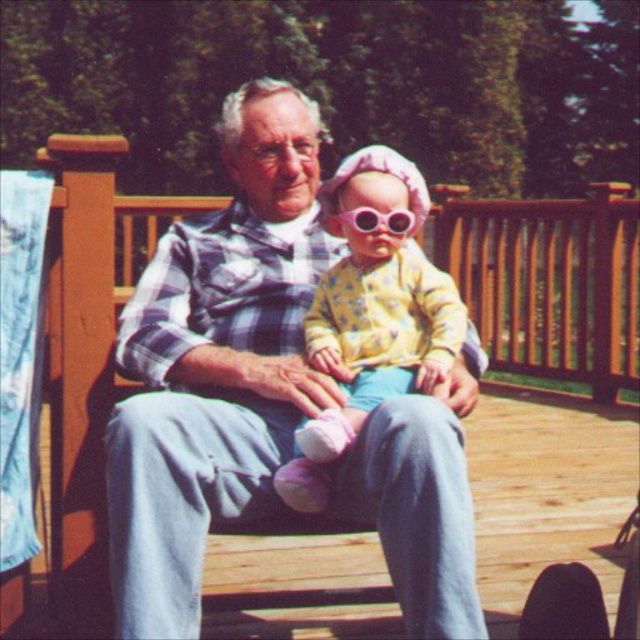
Is matte plaid shirt at center positioned before pink plastic goggles at center?

Yes.

Find the location of `matte plaid shirt at center`. matte plaid shirt at center is located at coordinates (216, 364).

Does point (324, 502) come behind point (352, 212)?

No, (324, 502) is closer to viewer.

Can you confirm if yellow fabric baby at center is thinner than pink plastic goggles at center?

No, yellow fabric baby at center is not thinner than pink plastic goggles at center.

Who is more forward, (368, 205) or (355, 227)?

Point (368, 205)

Identify the location of yellow fabric baby at center. (371, 317).

Is point (262, 371) farther from viewer compared to point (403, 237)?

No.

How far apart are matte plaid shirt at center and yellow fabric baby at center?

matte plaid shirt at center and yellow fabric baby at center are 6.75 inches apart from each other.

Between point (244, 221) and point (365, 285), which one is positioned in front?

Point (365, 285)

This screenshot has height=640, width=640. I want to click on matte plaid shirt at center, so (x=216, y=364).